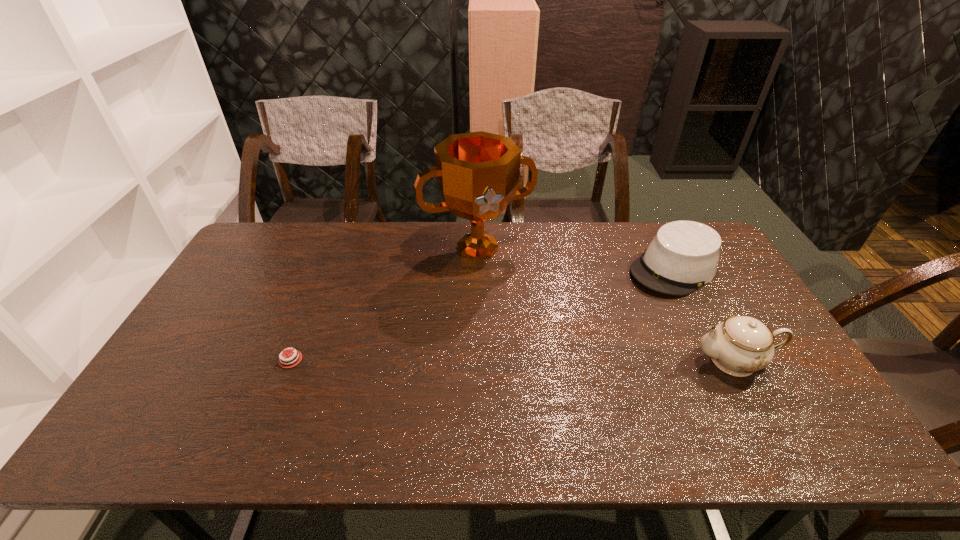
Where is `hat at the right edge`? Image resolution: width=960 pixels, height=540 pixels. hat at the right edge is located at coordinates (683, 256).

Where is `object at the far right corner`? The image size is (960, 540). object at the far right corner is located at coordinates (683, 256).

This screenshot has width=960, height=540. I want to click on object present at the near right corner, so click(740, 345).

At what (x,y) coordinates should I click in order to perform the action: click on vacant space at the far edge. Please return your answer as a coordinate pair (x, y). This screenshot has height=540, width=960. Looking at the image, I should click on (513, 258).

The height and width of the screenshot is (540, 960). Find the location of `vacant region at the near edge of the desktop`. vacant region at the near edge of the desktop is located at coordinates (641, 384).

At what (x,y) coordinates should I click in order to perform the action: click on vacant space at the left edge of the desktop. Please return your answer as a coordinate pair (x, y). Looking at the image, I should click on (227, 300).

The width and height of the screenshot is (960, 540). In order to click on vacant area at the right edge in this screenshot , I will do `click(713, 283)`.

In order to click on vacant space at the near right corner of the desktop in this screenshot , I will do `click(775, 390)`.

This screenshot has width=960, height=540. I want to click on free spot between the chocolate cake and the chinaware, so click(x=513, y=360).

Locate an element on the screen. vacant point located between the chinaware and the award is located at coordinates (606, 304).